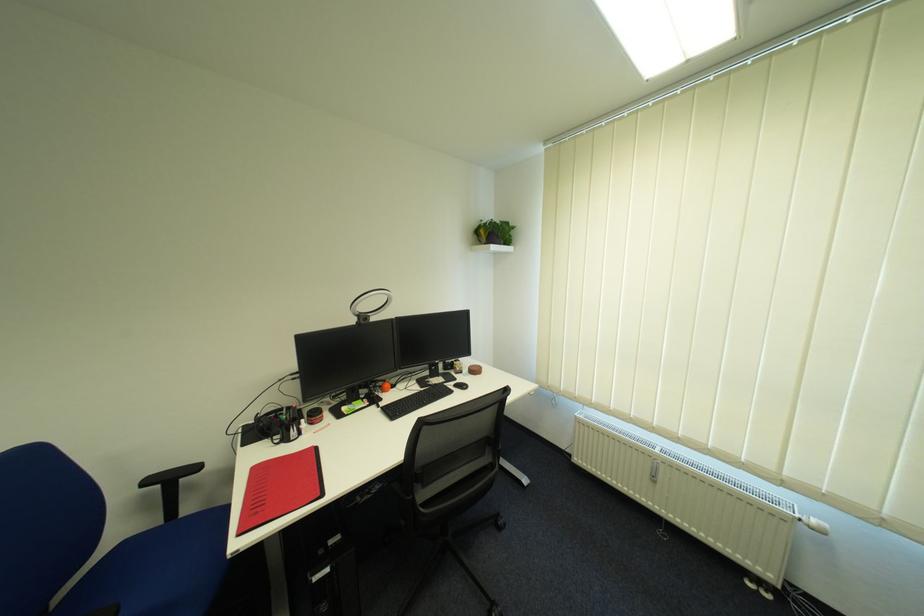
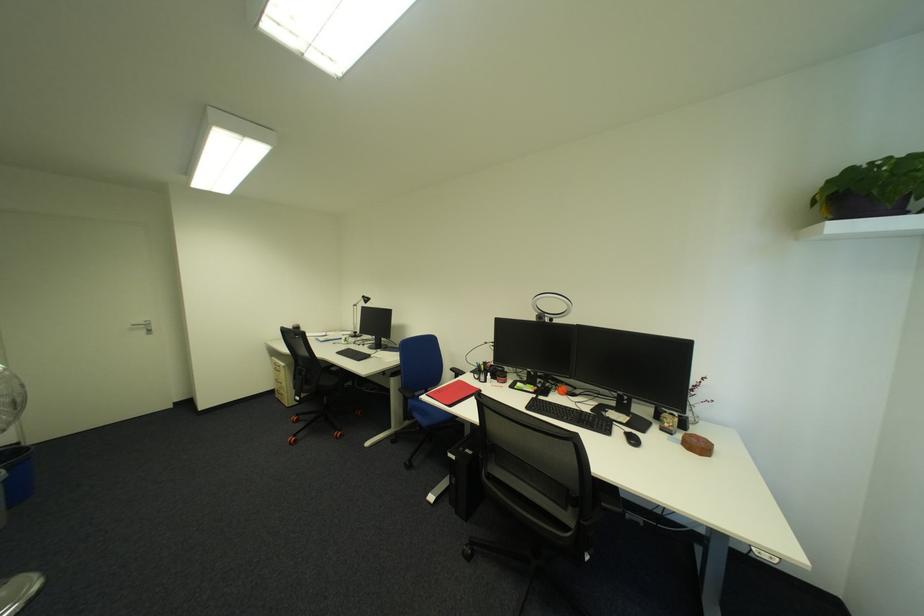
In the second image, find the point that corresponds to point (157, 483) in the first image.

(462, 370)